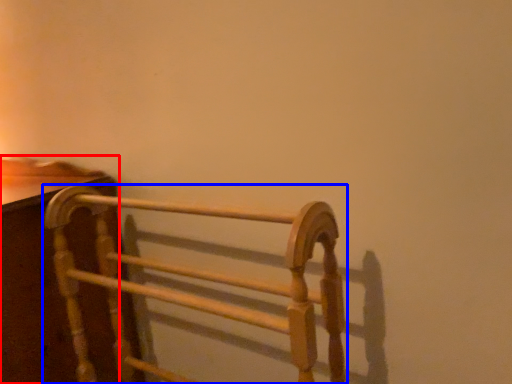
Question: Among these objects, which one is nearest to the camera, furniture (highlighted by a red box) or furniture (highlighted by a blue box)?

Choices:
 (A) furniture
 (B) furniture

Answer: (B)